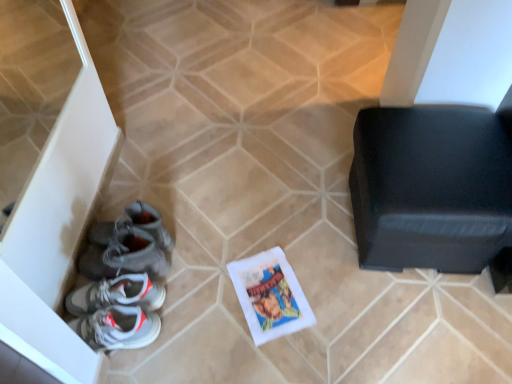
Find the location of a particular element. The height and width of the screenshot is (384, 512). free space above black leather ottoman at right (from a real-world perspective) is located at coordinates (444, 161).